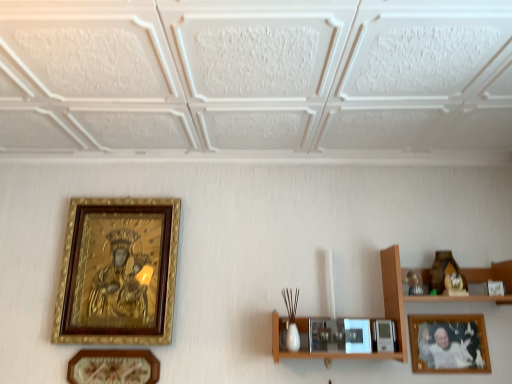
Question: From the image's perspective, is wooden framed photo at lower right, which is counted as the 3th picture frame, starting from the left, on goldwooden framepicture frame at left, marked as the third picture frame in a right-to-left arrangement?

Choices:
 (A) yes
 (B) no

Answer: (B)

Question: Considering the relative positions of wooden framed photo at lower right, the 1th picture frame viewed from the right, and goldwooden framepicture frame at left, the 1th picture frame from the left, in the image provided, is wooden framed photo at lower right, the 1th picture frame viewed from the right, behind goldwooden framepicture frame at left, the 1th picture frame from the left,?

Choices:
 (A) yes
 (B) no

Answer: (A)

Question: Is wooden framed photo at lower right, the 1th picture frame viewed from the right, surrounding goldwooden framepicture frame at left, marked as the third picture frame in a right-to-left arrangement?

Choices:
 (A) no
 (B) yes

Answer: (A)

Question: Does wooden framed photo at lower right, the 1th picture frame viewed from the right, have a lesser width compared to goldwooden framepicture frame at left, marked as the third picture frame in a right-to-left arrangement?

Choices:
 (A) no
 (B) yes

Answer: (B)

Question: Does wooden framed photo at lower right, which is counted as the 3th picture frame, starting from the left, have a greater width compared to goldwooden framepicture frame at left, marked as the third picture frame in a right-to-left arrangement?

Choices:
 (A) yes
 (B) no

Answer: (B)

Question: Does wooden framed photo at lower right, the 1th picture frame viewed from the right, have a larger size compared to goldwooden framepicture frame at left, the 1th picture frame from the left?

Choices:
 (A) no
 (B) yes

Answer: (A)

Question: Does goldwooden framepicture frame at left, marked as the third picture frame in a right-to-left arrangement, lie behind wooden framed photo at lower right, the 1th picture frame viewed from the right?

Choices:
 (A) no
 (B) yes

Answer: (A)

Question: Is goldwooden framepicture frame at left, the 1th picture frame from the left, thinner than wooden framed photo at lower right, which is counted as the 3th picture frame, starting from the left?

Choices:
 (A) yes
 (B) no

Answer: (B)

Question: Could you tell me if goldwooden framepicture frame at left, the 1th picture frame from the left, is turned towards wooden framed photo at lower right, the 1th picture frame viewed from the right?

Choices:
 (A) no
 (B) yes

Answer: (A)

Question: From a real-world perspective, is goldwooden framepicture frame at left, marked as the third picture frame in a right-to-left arrangement, located higher than wooden framed photo at lower right, which is counted as the 3th picture frame, starting from the left?

Choices:
 (A) yes
 (B) no

Answer: (A)

Question: Is goldwooden framepicture frame at left, the 1th picture frame from the left, shorter than wooden framed photo at lower right, which is counted as the 3th picture frame, starting from the left?

Choices:
 (A) yes
 (B) no

Answer: (B)

Question: From a real-world perspective, is goldwooden framepicture frame at left, marked as the third picture frame in a right-to-left arrangement, located beneath wooden framed photo at lower right, the 1th picture frame viewed from the right?

Choices:
 (A) no
 (B) yes

Answer: (A)

Question: Is wooden framed photo at lower right, which is counted as the 3th picture frame, starting from the left, placed right next to wooden shelf at right?

Choices:
 (A) yes
 (B) no

Answer: (B)